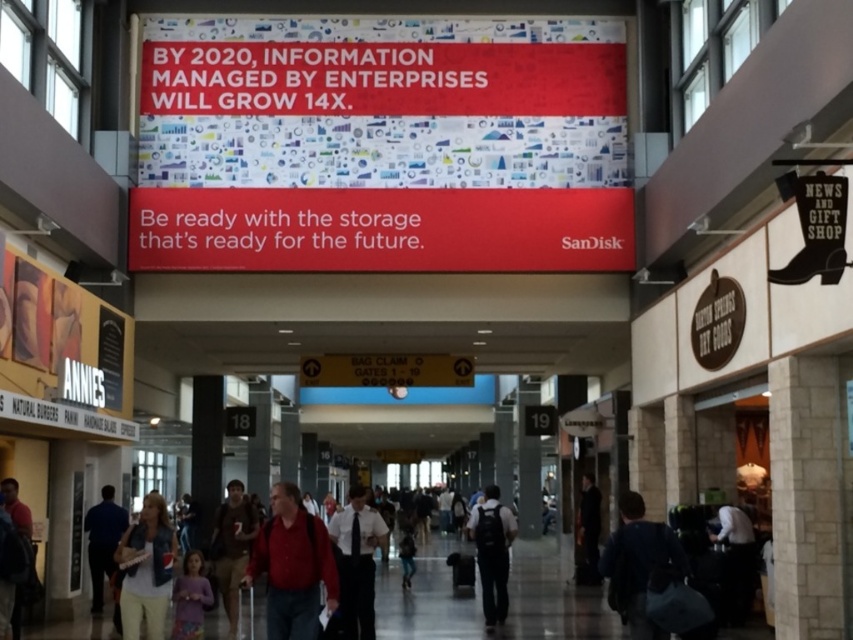
You are standing in the airport terminal and want to reach the point marked at coordinates point (x=123, y=595). The distance between you and this point is 24.96 meters. If you walk at a speed of 1.5 meters per second, how long will it take you to reach the point?

The distance between you and the point (x=123, y=595) is 24.96 meters. At a walking speed of 1.5 meters per second, it will take approximately 16.64 seconds to reach the point.

You are an airport security agent checking the height of two items. You see a matte purple shirt at lower left and a dark fabric jacket at center. Which item is taller?

The matte purple shirt at lower left has a greater height compared to the dark fabric jacket at center, so the matte purple shirt at lower left is taller.